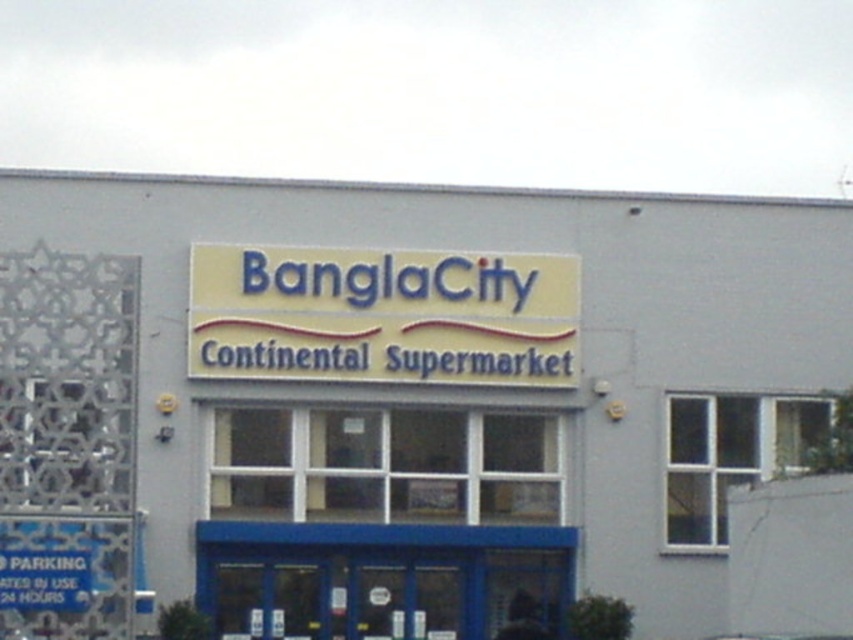
You are a customer standing in front of the supermarket entrance. You see two signs, the white matte sign at center and the yellow matte sign at center. Which sign do you see first when looking straight ahead?

The white matte sign at center is closer to the viewer than the yellow matte sign at center, so you would see the white matte sign at center first when looking straight ahead.

You are a customer approaching the entrance of the supermarket and see the white matte sign at center and the yellow matte sign at center. Which sign should you look at first if you want to find the store hours?

The white matte sign at center is larger in size than the yellow matte sign at center, so it is more likely to display store hours as larger signs often highlight important information.